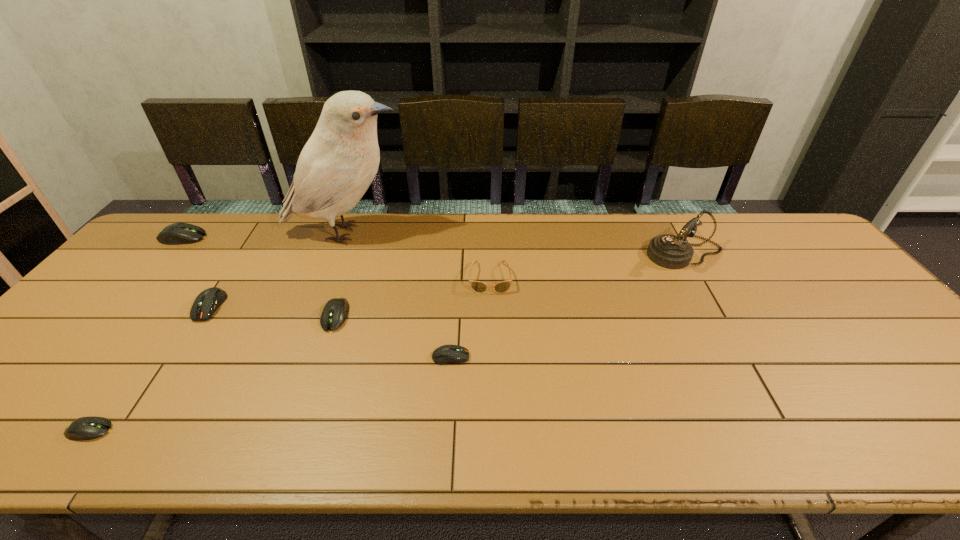
Locate an element on the screen. This screenshot has width=960, height=540. free space between the second gray computer mouse from right to left and the second biggest gray computer mouse is located at coordinates (213, 373).

This screenshot has width=960, height=540. Find the location of `free area in between the biggest gray computer mouse and the third object from left to right`. free area in between the biggest gray computer mouse and the third object from left to right is located at coordinates (197, 272).

Where is `vacant area that lies between the nearest object and the third object from left to right`? vacant area that lies between the nearest object and the third object from left to right is located at coordinates (150, 368).

Image resolution: width=960 pixels, height=540 pixels. I want to click on vacant space in between the nearer dark computer equipment and the farther dark computer equipment, so click(x=330, y=332).

You are a GUI agent. You are given a task and a screenshot of the screen. Output one action in this format:
    pyautogui.click(x=<x>, y=<y>)
    Task: Click on the object that is the fourth closest to the sunglasses
    The image size is (960, 540).
    Given the screenshot: What is the action you would take?
    coord(669,251)

This screenshot has height=540, width=960. Identify the location of object that is the third closest to the white parakeet. (335, 312).

Point out which computer mouse is positioned as the second nearest to the left dark computer equipment. Please provide its 2D coordinates. Your answer should be formatted as a tuple, i.e. [(x, y)], where the tuple contains the x and y coordinates of a point satisfying the conditions above.

[(85, 428)]

Locate which computer mouse is the fifth closest to the sunglasses. Please provide its 2D coordinates. Your answer should be formatted as a tuple, i.e. [(x, y)], where the tuple contains the x and y coordinates of a point satisfying the conditions above.

[(177, 233)]

At what (x,y) coordinates should I click in order to perform the action: click on the closest gray computer mouse to the parakeet. Please return your answer as a coordinate pair (x, y). This screenshot has width=960, height=540. Looking at the image, I should click on (335, 312).

At what (x,y) coordinates should I click in order to perform the action: click on gray computer mouse that stands as the closest to the nearest computer mouse. Please return your answer as a coordinate pair (x, y). This screenshot has height=540, width=960. Looking at the image, I should click on (335, 312).